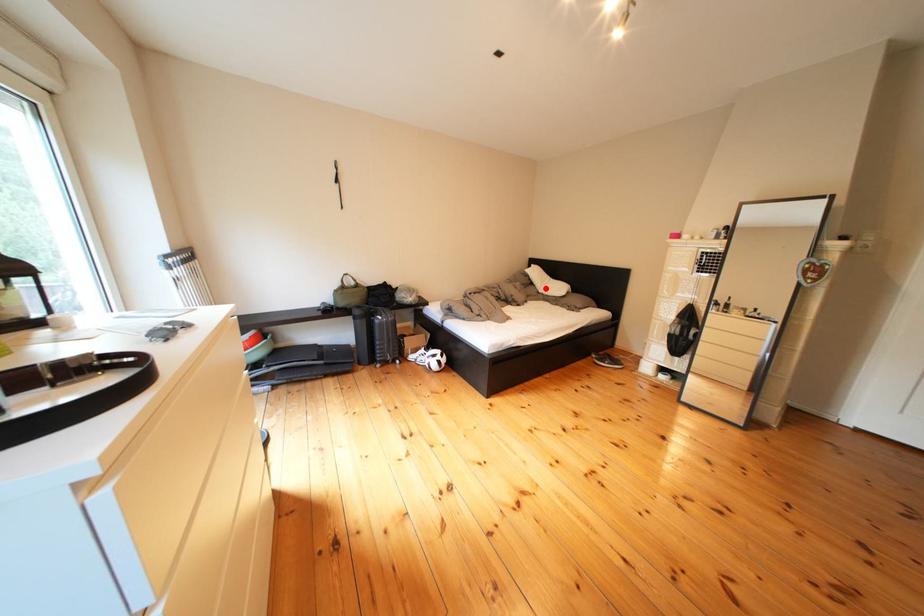
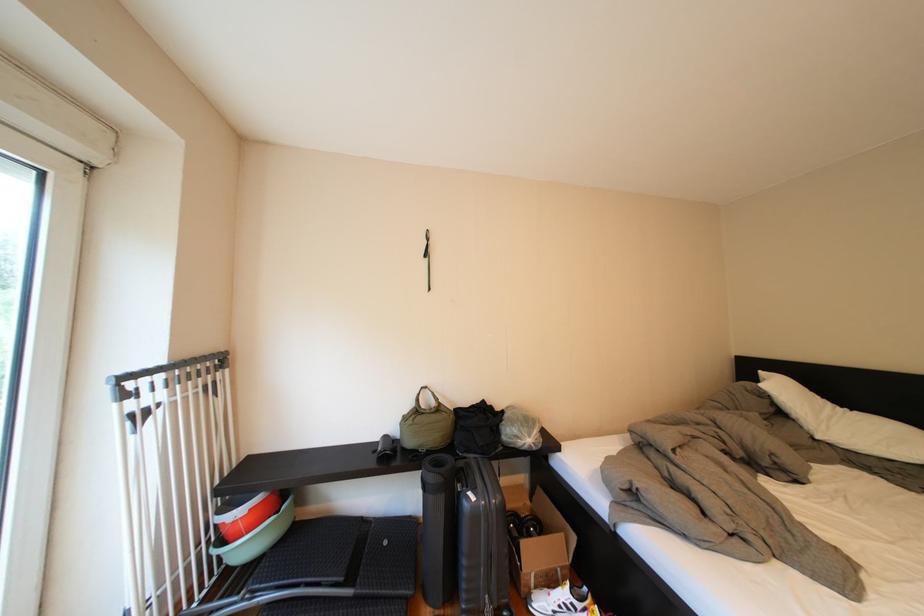
The point at the highlighted location is marked in the first image. Where is the corresponding point in the second image?

(795, 419)